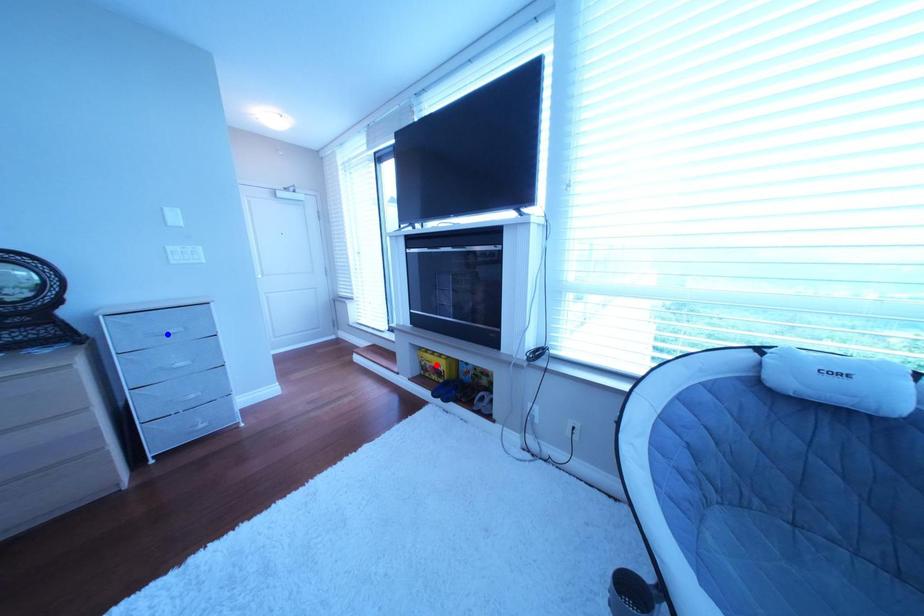
Question: Which of the two points in the image is closer to the camera?

Choices:
 (A) Blue point is closer.
 (B) Red point is closer.

Answer: (A)